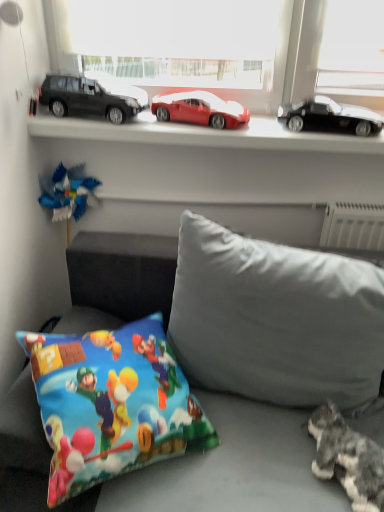
Locate an element on the screen. free location to the left of gray fluffy cat at lower right is located at coordinates (268, 459).